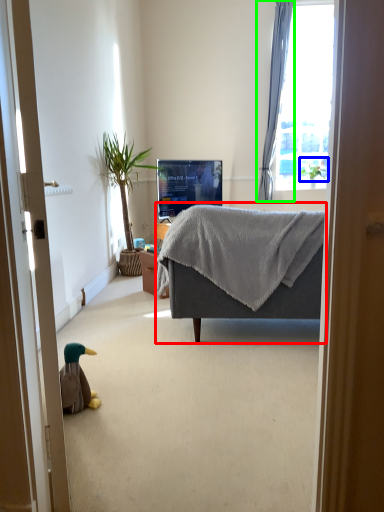
Question: Which object is positioned farthest from studio couch (highlighted by a red box)? Select from plant (highlighted by a blue box) and curtain (highlighted by a green box).

Choices:
 (A) plant
 (B) curtain

Answer: (B)